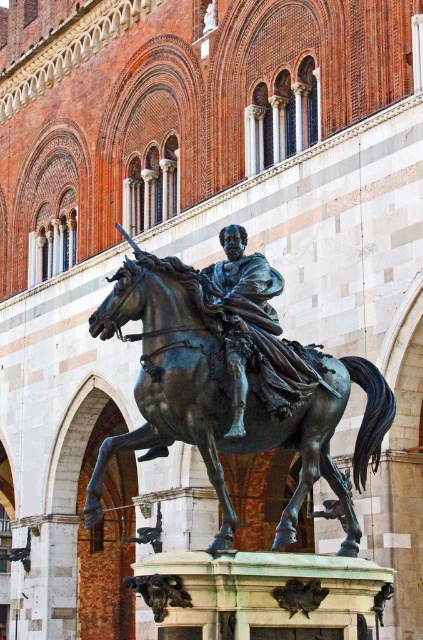
Does bronze horse at center lie in front of bronze statue at center?

No.

Identify the location of bronze horse at center. The width and height of the screenshot is (423, 640). (228, 394).

Does point (153, 333) come farther from viewer compared to point (246, 308)?

No, it is in front of (246, 308).

At what (x,y) coordinates should I click in order to perform the action: click on bronze horse at center. Please return your answer as a coordinate pair (x, y). Looking at the image, I should click on (228, 394).